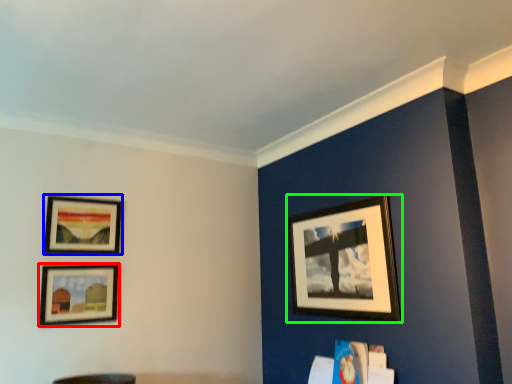
Question: Considering the real-world distances, which object is closest to picture frame (highlighted by a red box)? picture frame (highlighted by a blue box) or picture frame (highlighted by a green box).

Choices:
 (A) picture frame
 (B) picture frame

Answer: (A)